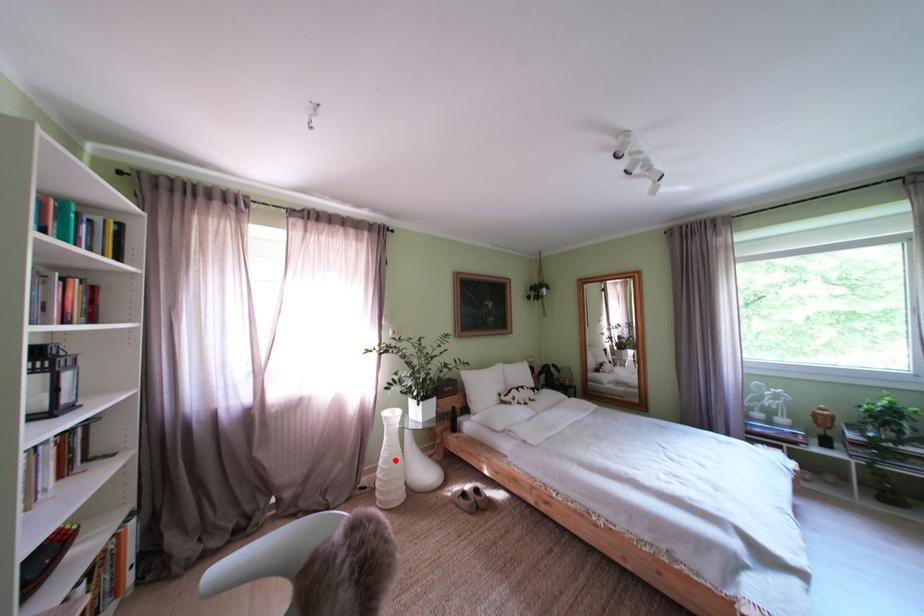
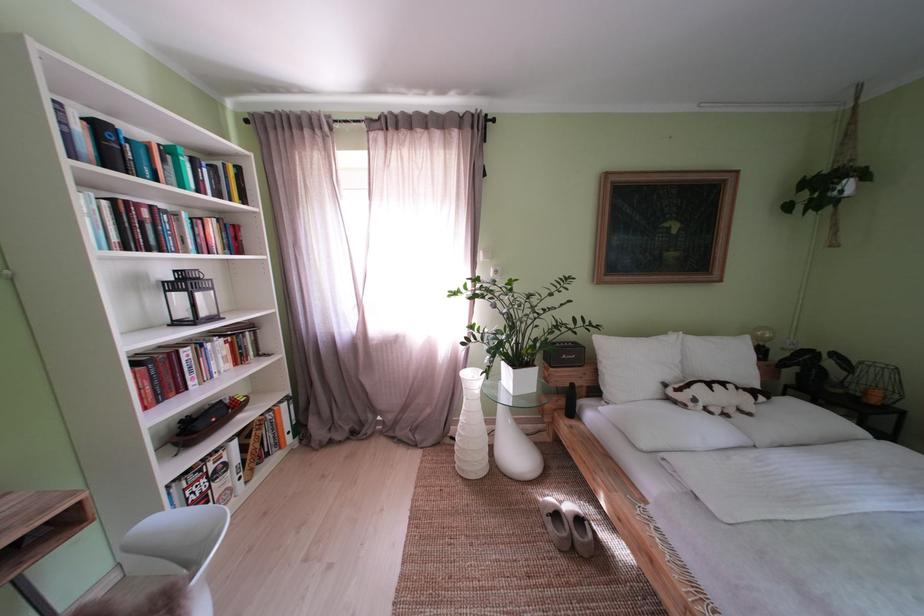
In the second image, find the point that corresponds to the highlighted location in the first image.

(472, 424)